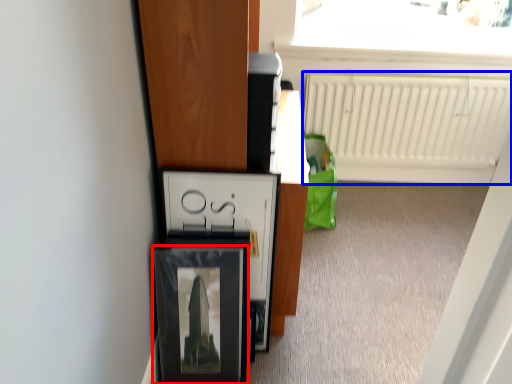
Question: Among these objects, which one is nearest to the camera, picture frame (highlighted by a red box) or radiator (highlighted by a blue box)?

Choices:
 (A) picture frame
 (B) radiator

Answer: (A)